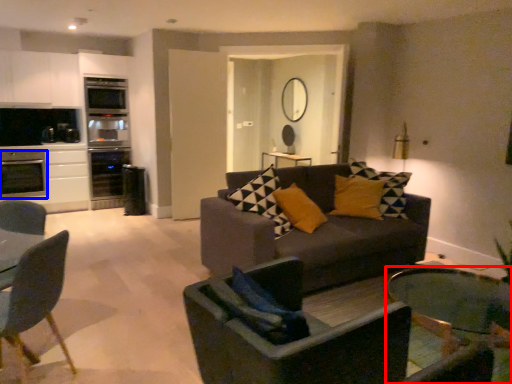
Question: Which point is further to the camera, coffee table (highlighted by a red box) or appliance (highlighted by a blue box)?

Choices:
 (A) coffee table
 (B) appliance

Answer: (B)